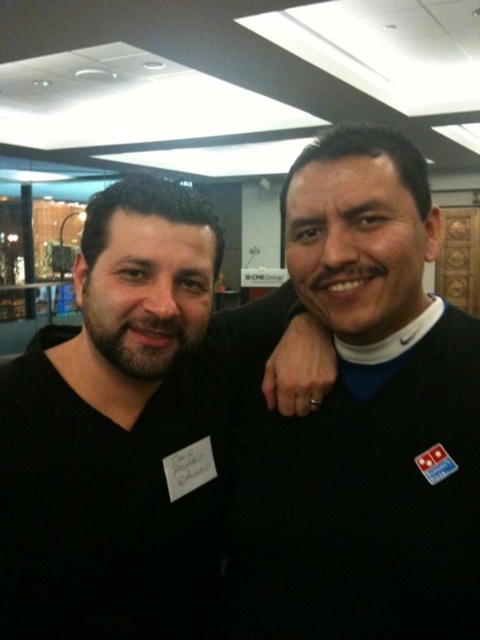
Question: Can you confirm if black sweater at right is positioned to the right of black matte shirt at center?

Choices:
 (A) no
 (B) yes

Answer: (B)

Question: Can you confirm if black sweater at right is positioned to the left of black matte shirt at center?

Choices:
 (A) no
 (B) yes

Answer: (A)

Question: Does black sweater at right lie behind black matte shirt at center?

Choices:
 (A) no
 (B) yes

Answer: (A)